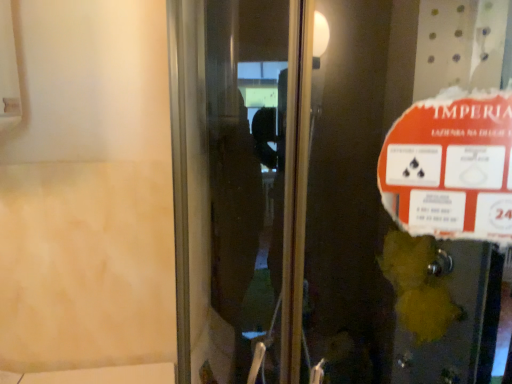
Question: Does transparent glass elevator door at center come in front of orange paper sign at upper right?

Choices:
 (A) no
 (B) yes

Answer: (B)

Question: Is transparent glass elevator door at center shorter than orange paper sign at upper right?

Choices:
 (A) no
 (B) yes

Answer: (A)

Question: Would you say transparent glass elevator door at center contains orange paper sign at upper right?

Choices:
 (A) yes
 (B) no

Answer: (A)

Question: From the image's perspective, is transparent glass elevator door at center on top of orange paper sign at upper right?

Choices:
 (A) no
 (B) yes

Answer: (A)

Question: Is transparent glass elevator door at center far away from orange paper sign at upper right?

Choices:
 (A) no
 (B) yes

Answer: (A)

Question: From a real-world perspective, is transparent glass elevator door at center positioned under orange paper sign at upper right based on gravity?

Choices:
 (A) no
 (B) yes

Answer: (B)

Question: Considering the relative sizes of orange paper sign at upper right and transparent glass elevator door at center in the image provided, is orange paper sign at upper right bigger than transparent glass elevator door at center?

Choices:
 (A) yes
 (B) no

Answer: (B)

Question: Considering the relative sizes of orange paper sign at upper right and transparent glass elevator door at center in the image provided, is orange paper sign at upper right thinner than transparent glass elevator door at center?

Choices:
 (A) yes
 (B) no

Answer: (A)

Question: Would you say orange paper sign at upper right is a long distance from transparent glass elevator door at center?

Choices:
 (A) no
 (B) yes

Answer: (A)

Question: From a real-world perspective, is orange paper sign at upper right on top of transparent glass elevator door at center?

Choices:
 (A) yes
 (B) no

Answer: (A)

Question: Is orange paper sign at upper right to the left of transparent glass elevator door at center from the viewer's perspective?

Choices:
 (A) no
 (B) yes

Answer: (A)

Question: Is orange paper sign at upper right at the right side of transparent glass elevator door at center?

Choices:
 (A) no
 (B) yes

Answer: (B)

Question: Is transparent glass elevator door at center wider or thinner than orange paper sign at upper right?

Choices:
 (A) thin
 (B) wide

Answer: (B)